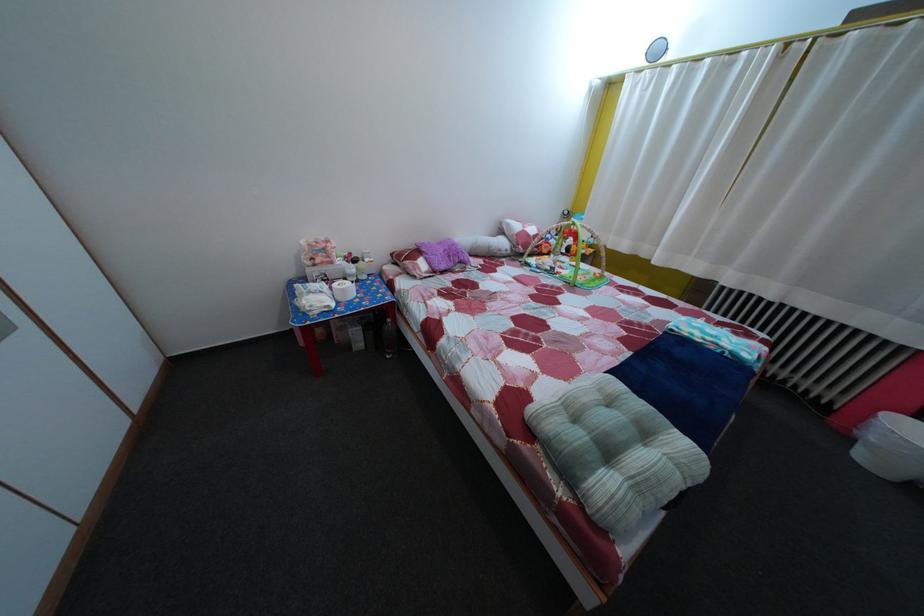
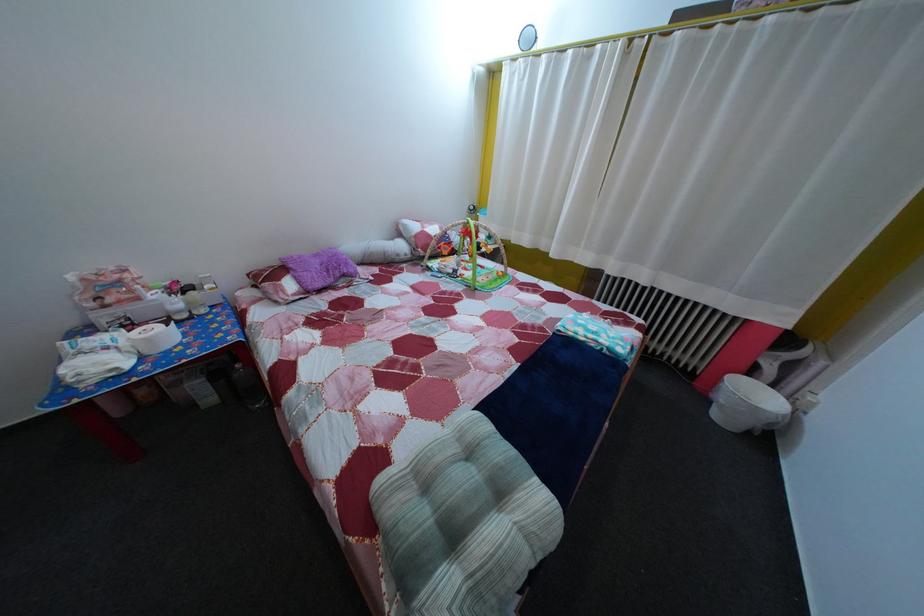
The point at (570, 390) is marked in the first image. Where is the corresponding point in the second image?

(442, 432)